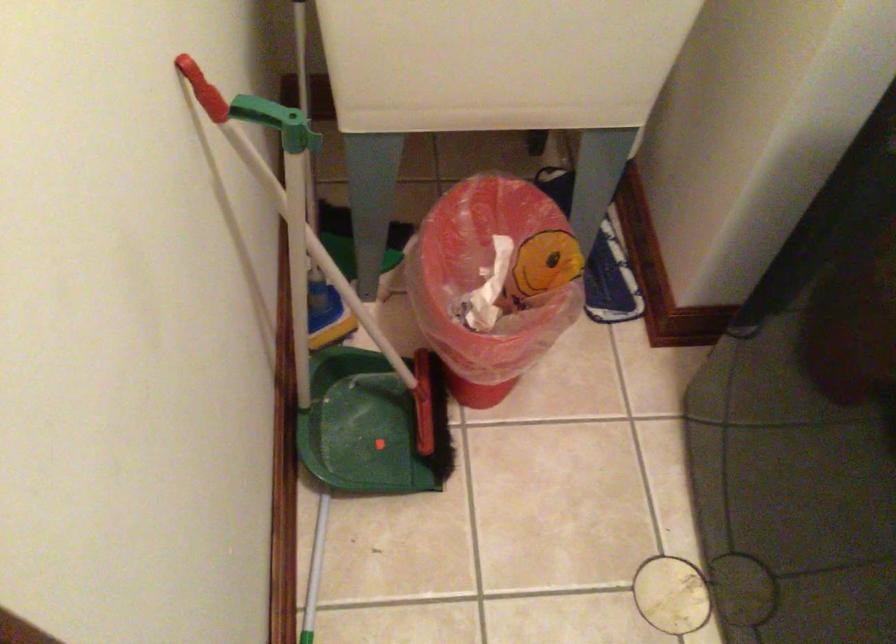
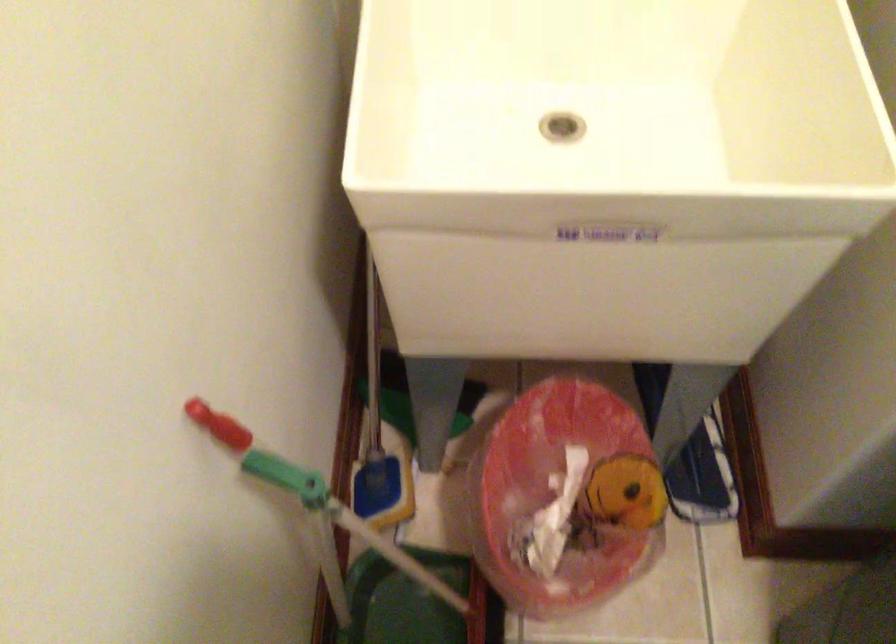
Question: What movement of the cameraman would produce the second image?

Choices:
 (A) Left
 (B) Right
 (C) Forward
 (D) Backward

Answer: (C)